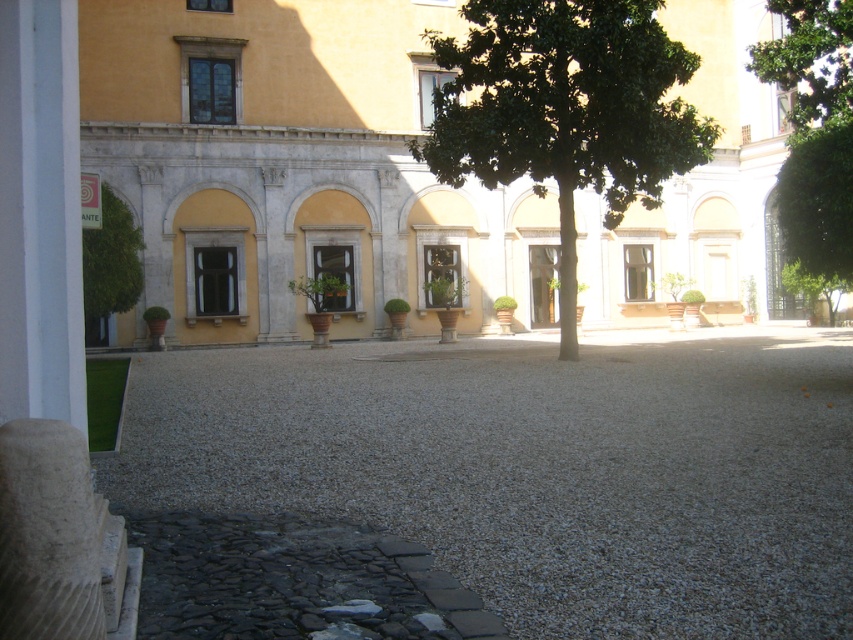
Between point (415, 259) and point (488, 156), which one is positioned in front?

Point (488, 156) is more forward.

Does yellow stone building at center have a greater height compared to green leafy tree at center?

Correct, yellow stone building at center is much taller as green leafy tree at center.

Does point (718, 248) come behind point (575, 80)?

Yes, point (718, 248) is behind point (575, 80).

I want to click on yellow stone building at center, so click(296, 166).

Is point (682, 513) more distant than point (837, 99)?

No.

The image size is (853, 640). I want to click on gray gravel at center, so click(538, 467).

Between point (263, 452) and point (814, 266), which one is positioned behind?

Positioned behind is point (814, 266).

This screenshot has width=853, height=640. Find the location of `gray gravel at center`. gray gravel at center is located at coordinates (538, 467).

Is gray gravel at center below yellow stone building at center?

Yes, gray gravel at center is below yellow stone building at center.

Who is positioned more to the right, gray gravel at center or yellow stone building at center?

Positioned to the right is yellow stone building at center.

Is point (711, 589) positioned after point (114, 60)?

No, (711, 589) is closer to viewer.

You are a GUI agent. You are given a task and a screenshot of the screen. Output one action in this format:
    pyautogui.click(x=<x>, y=<y>)
    Task: Click on the gray gravel at center
    
    Given the screenshot: What is the action you would take?
    pyautogui.click(x=538, y=467)